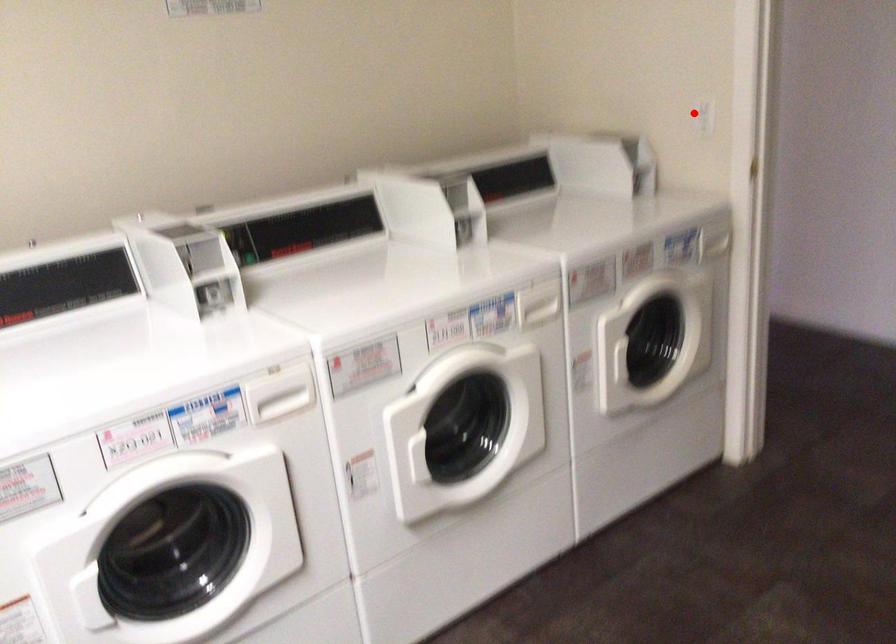
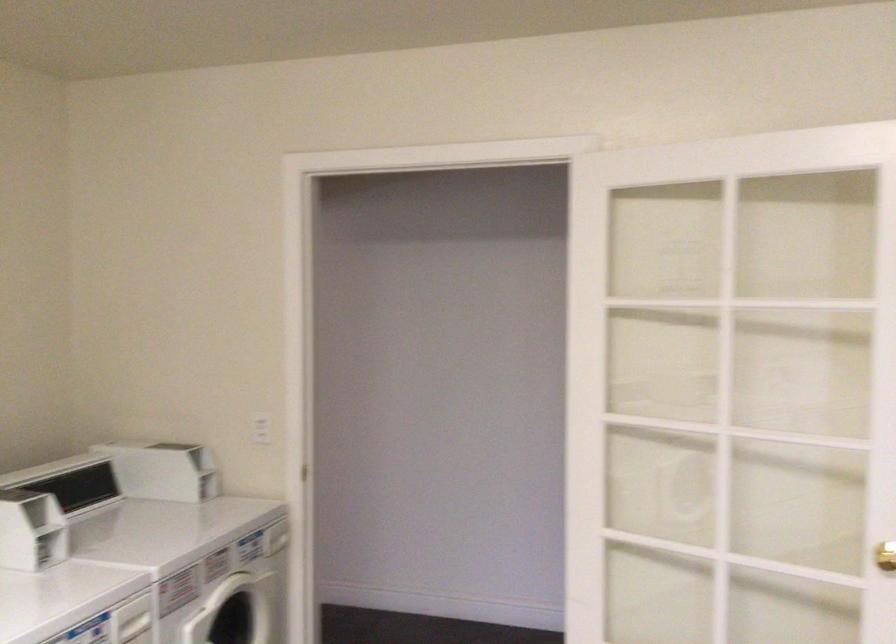
Question: I am providing you with two images of the same scene from different viewpoints. A red point is shown in image1. For the corresponding object point in image2, is it positioned nearer or farther from the camera?

Choices:
 (A) Nearer
 (B) Farther

Answer: (B)